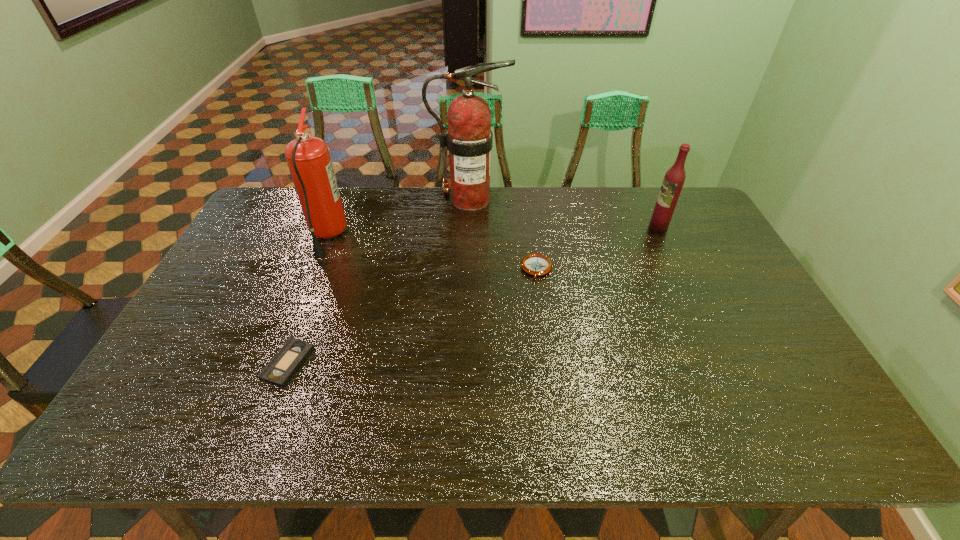
In order to click on the taller fire extinguisher in this screenshot , I will do `click(469, 139)`.

The width and height of the screenshot is (960, 540). What are the coordinates of `the right fire extinguisher` in the screenshot? It's located at (469, 139).

Identify the location of the shorter fire extinguisher. Image resolution: width=960 pixels, height=540 pixels. (308, 158).

Where is `the nearer fire extinguisher`? This screenshot has width=960, height=540. the nearer fire extinguisher is located at coordinates (308, 158).

Image resolution: width=960 pixels, height=540 pixels. Find the location of `liquor`. liquor is located at coordinates (674, 179).

Where is `the third shortest object`? The image size is (960, 540). the third shortest object is located at coordinates (674, 179).

In order to click on the fourth tallest object in this screenshot , I will do `click(535, 264)`.

At what (x,y) coordinates should I click in order to perform the action: click on compass. Please return your answer as a coordinate pair (x, y). Looking at the image, I should click on (535, 264).

The image size is (960, 540). What are the coordinates of `the nearest object` in the screenshot? It's located at (289, 358).

Image resolution: width=960 pixels, height=540 pixels. I want to click on the shortest object, so click(289, 358).